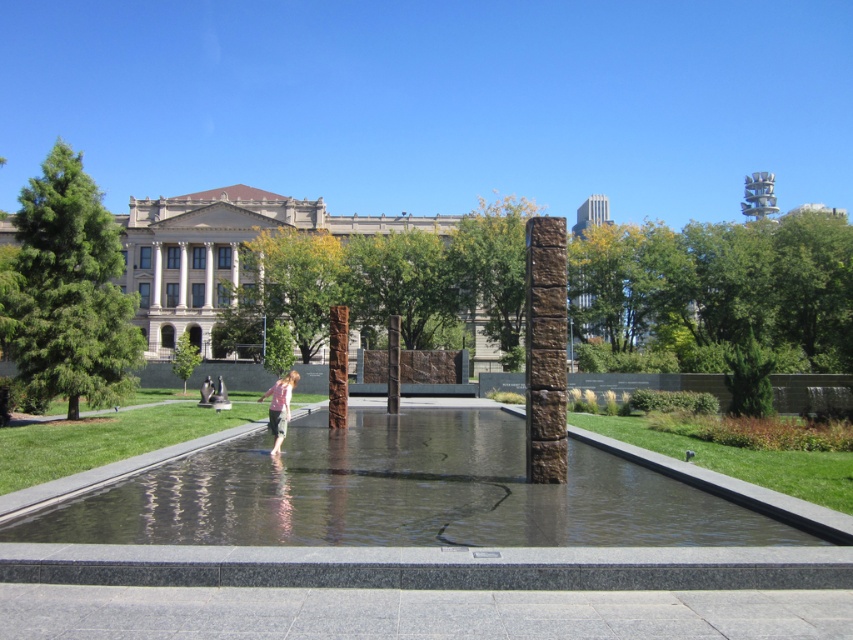
Is pink fabric person at center wider than green leafy tree at center?

No, pink fabric person at center is not wider than green leafy tree at center.

Who is positioned more to the left, pink fabric person at center or green leafy tree at center?

From the viewer's perspective, green leafy tree at center appears more on the left side.

Measure the distance between pink fabric person at center and camera.

They are 46.82 feet apart.

The image size is (853, 640). Identify the location of pink fabric person at center. (x=279, y=406).

Does green glossy tree at left appear over brown stone pillar at center?

Indeed, green glossy tree at left is positioned over brown stone pillar at center.

Is green glossy tree at left closer to the viewer compared to brown stone pillar at center?

No, it is not.

Is point (122, 378) positioned behind point (546, 456)?

That is True.

The image size is (853, 640). What are the coordinates of `green glossy tree at left` in the screenshot? It's located at (70, 291).

Which is more to the left, clear glass water at center or brown stone pillar at center?

clear glass water at center

At what (x,y) coordinates should I click in order to perform the action: click on clear glass water at center. Please return your answer as a coordinate pair (x, y). This screenshot has width=853, height=640. Looking at the image, I should click on (401, 493).